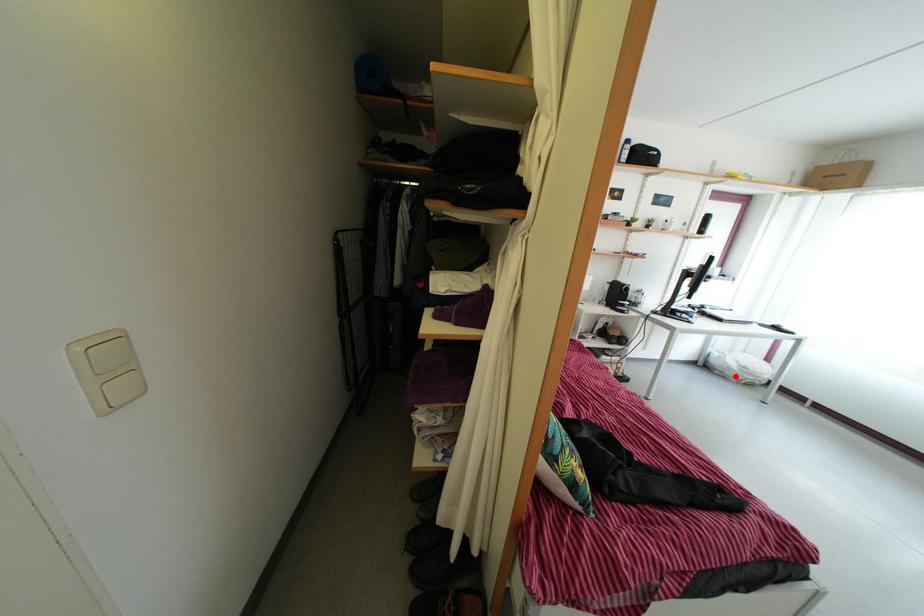
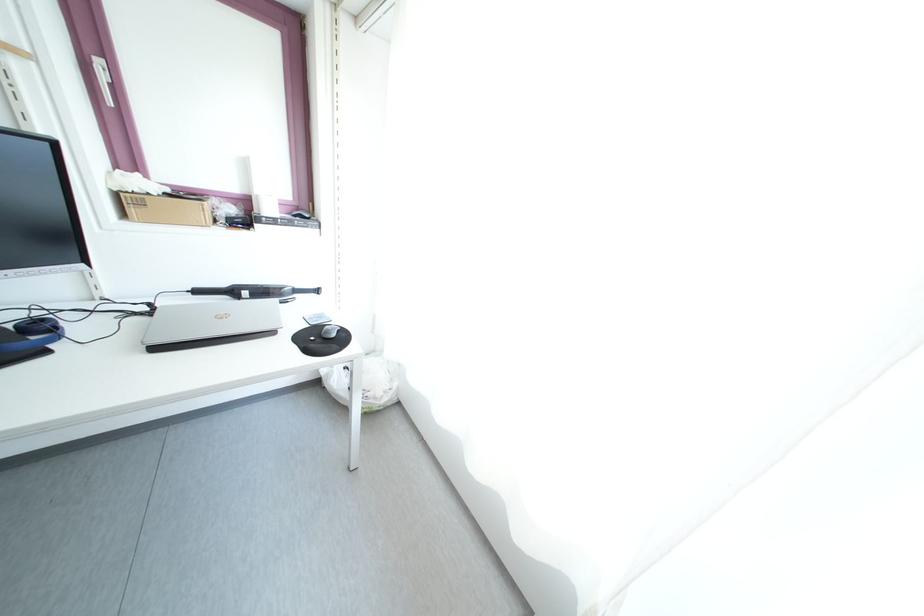
Question: I am providing you with two images of the same scene from different viewpoints. In image1, a red point is highlighted. Considering the same 3D point in image2, which of the following is correct?

Choices:
 (A) It is closer
 (B) It is farther

Answer: (B)